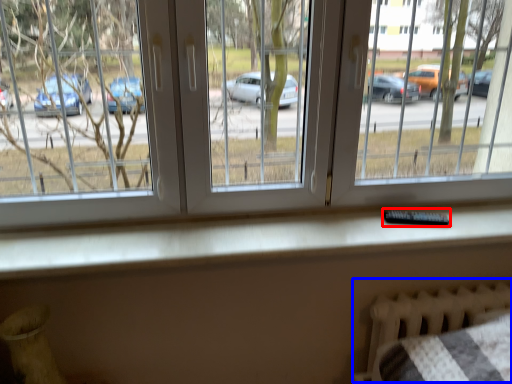
Question: Which of the following is the farthest to the observer, remote (highlighted by a red box) or bed frame (highlighted by a blue box)?

Choices:
 (A) remote
 (B) bed frame

Answer: (B)